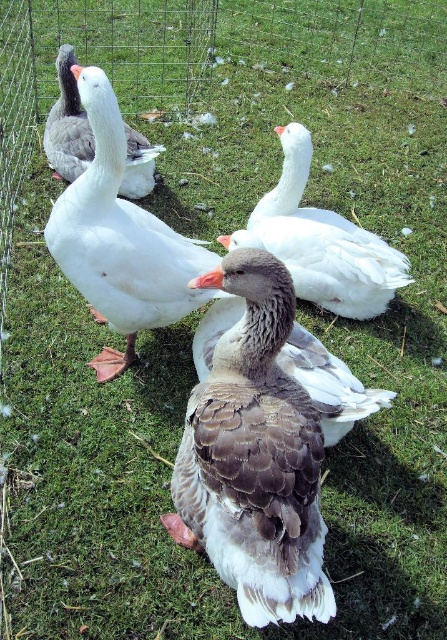
Question: Among these objects, which one is farthest from the camera?

Choices:
 (A) gray feathered duck at center
 (B) gray-brown feathered duck at center
 (C) white matte duck at center
 (D) gray matte goose at upper left

Answer: (D)

Question: Does white matte duck at center have a larger size compared to gray-brown feathered duck at center?

Choices:
 (A) yes
 (B) no

Answer: (A)

Question: Which point is farther to the camera?

Choices:
 (A) gray feathered duck at center
 (B) gray-brown feathered duck at center
 (C) white matte duck at center

Answer: (B)

Question: Is gray-brown feathered duck at center behind gray matte goose at upper left?

Choices:
 (A) no
 (B) yes

Answer: (A)

Question: Is gray feathered duck at center in front of white matte duck at center?

Choices:
 (A) yes
 (B) no

Answer: (A)

Question: Based on their relative distances, which object is farther from the gray matte goose at upper left?

Choices:
 (A) white fluffy goose at center
 (B) gray feathered duck at center

Answer: (B)